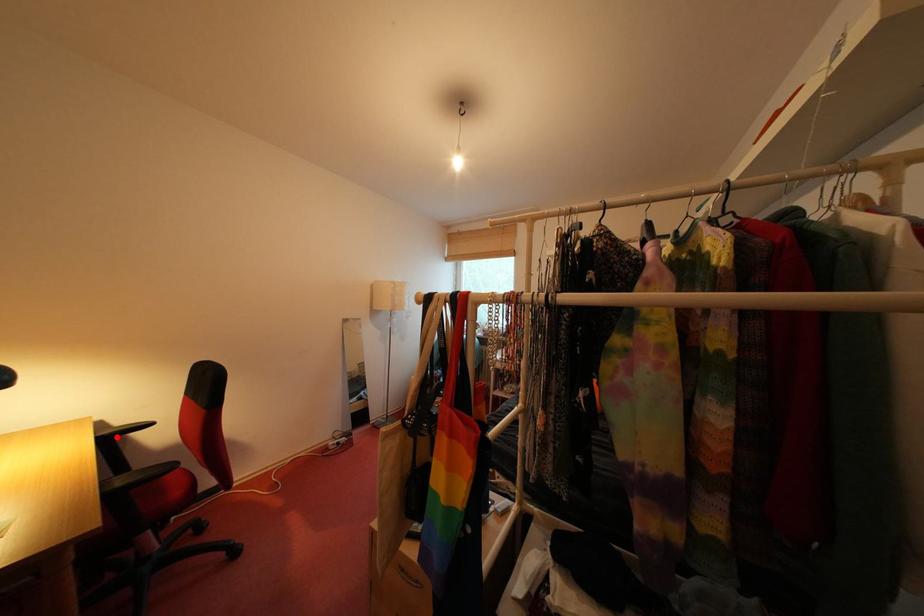
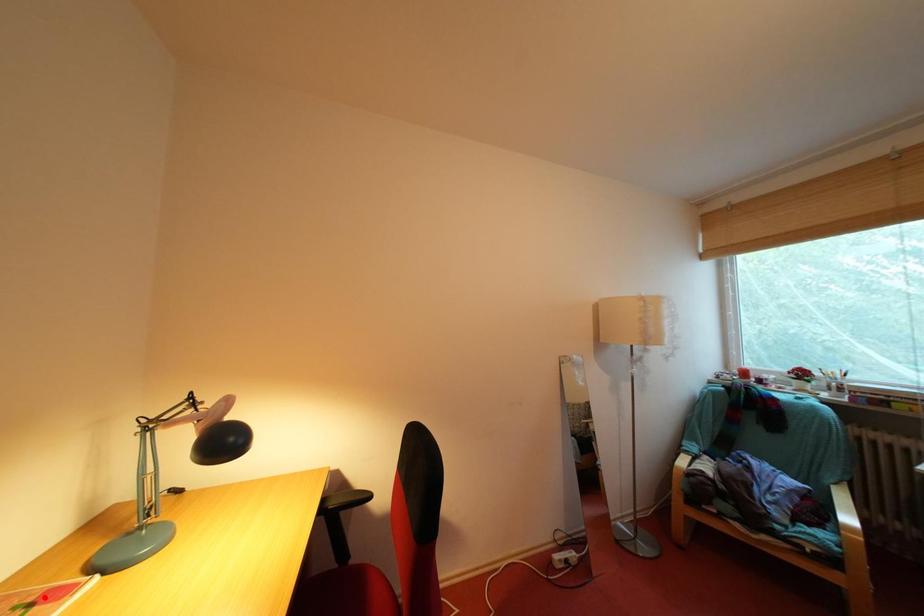
I am providing you with two images of the same scene from different viewpoints. A red point is marked on the first image and another point is marked on the second image. Are the points marked in image1 and image2 representing the same 3D position?

No